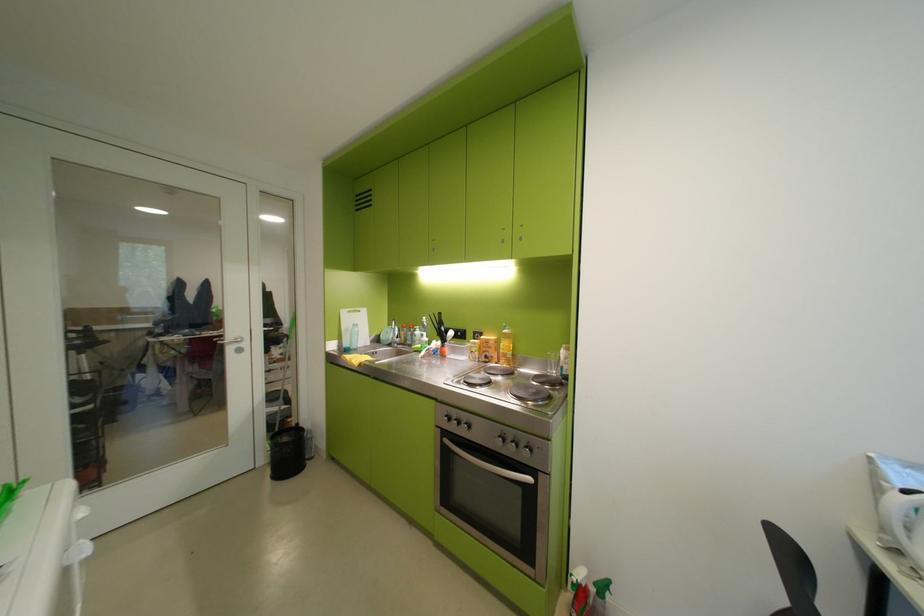
Where would you pull the oven door handle? Please return your answer as a coordinate pair (x, y).

(488, 464)